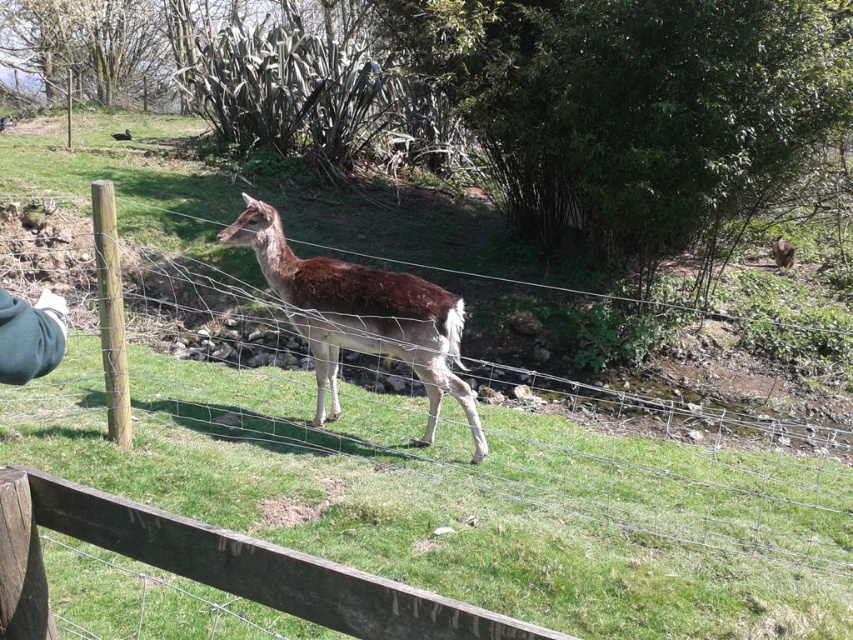
You are a photographer aiming to capture the deer in the scene. You notice two points marked in the image. The first point is at coordinate point (329,349) and the second is at point (770,250). Which point is closer to the deer?

Point (329,349) is in front of point (770,250), so it is closer to the deer.

You are an animal photographer trying to capture the brown speckled fur at center. The wooden fence at center is blocking part of your view. Based on their sizes, which object should you adjust your camera angle to focus on first?

The wooden fence at center is smaller than the brown speckled fur at center, so you should adjust your camera angle to focus on the wooden fence at center first to ensure it doesn not block the larger brown speckled fur at center.

You are a photographer standing at the camera position. You want to take a photo of the deer behind the wooden fence at center. Considering the distance between you and the fence, can you focus on both the deer and the fence simultaneously in one shot?

The distance between the wooden fence at center and the camera is 16.80 feet. To focus on both the deer behind the fence and the fence itself, the depth of field must cover this distance. However, without knowing the camera settings or lens aperture, it is impossible to definitively say. But generally, at 16.80 feet, achieving sharp focus on both might be challenging unless using a small aperture for greater depth of field.